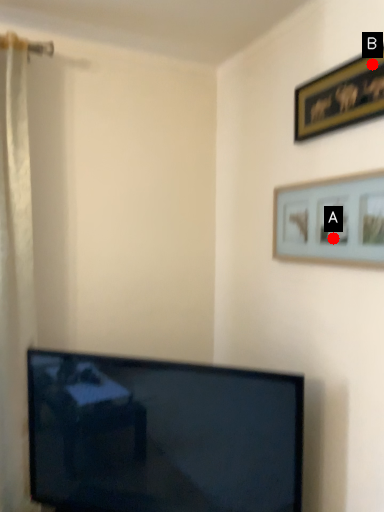
Question: Two points are circled on the image, labeled by A and B beside each circle. Which of the following is the farthest from the observer?

Choices:
 (A) A is further
 (B) B is further

Answer: (A)